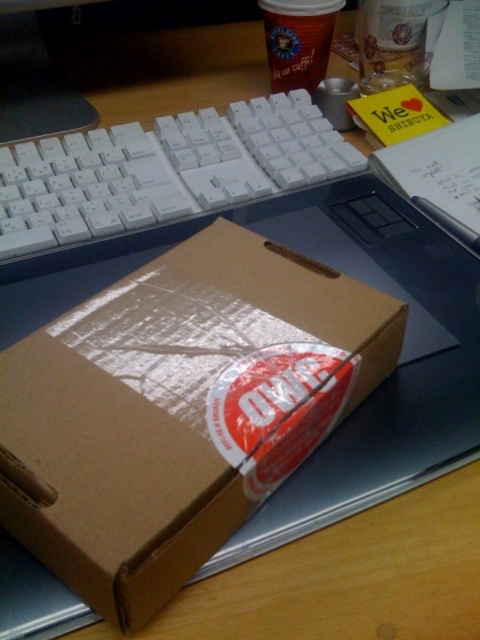
Between point (41, 349) and point (274, 182), which one is positioned behind?

The point (274, 182) is behind.

Does brown cardboard box at center have a larger size compared to white plastic keyboard at center?

Incorrect, brown cardboard box at center is not larger than white plastic keyboard at center.

Is point (62, 451) positioned after point (276, 173)?

No, it is not.

The width and height of the screenshot is (480, 640). Find the location of `brown cardboard box at center`. brown cardboard box at center is located at coordinates (x=178, y=410).